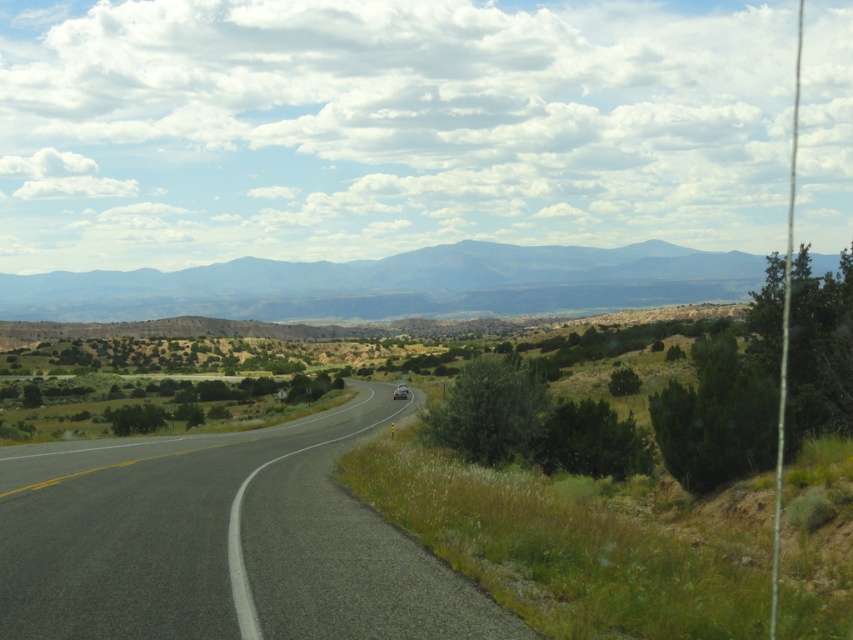
You are a driver planning to take a road trip on the asphalt road at center. You notice a metallic silver car at center ahead of you. Since the road is wider than the car, can you safely pass the car on either side without leaving the road?

The asphalt road at center has a larger size compared to the metallic silver car at center, so yes, you can safely pass the metallic silver car at center on either side without leaving the road.

You are a driver approaching the asphalt road at center and see the metallic silver car at center ahead. Which object is closer to you?

The metallic silver car at center is closer to you since the asphalt road at center is in front of it, meaning the car is between you and the road.